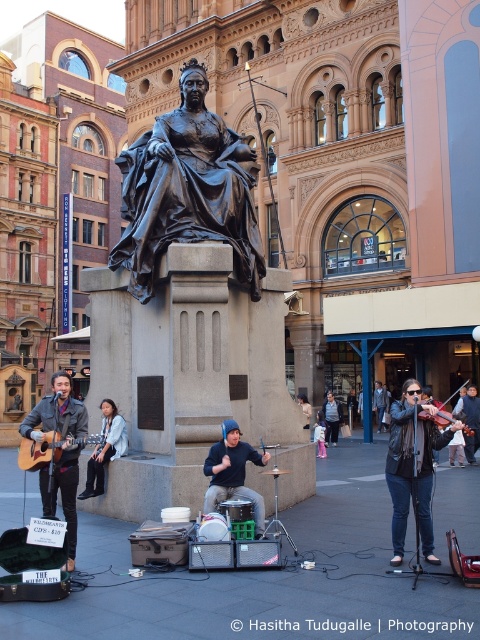
Question: Is black polished statue at center above acoustic guitar at lower left?

Choices:
 (A) no
 (B) yes

Answer: (B)

Question: From the image, what is the correct spatial relationship of denim jacket at lower left in relation to acoustic guitar at lower left?

Choices:
 (A) right
 (B) left

Answer: (A)

Question: Is black polished statue at center positioned in front of denim jacket at lower left?

Choices:
 (A) no
 (B) yes

Answer: (A)

Question: Which of the following is the closest to the observer?

Choices:
 (A) wooden violin at center
 (B) dark gray sweater at center
 (C) black drum set at center

Answer: (A)

Question: Which of the following is the farthest from the observer?

Choices:
 (A) (156, 256)
 (B) (120, 417)
 (C) (425, 550)

Answer: (B)

Question: Which point is closer to the camera?

Choices:
 (A) denim jacket at lower left
 (B) dark gray sweater at center

Answer: (A)